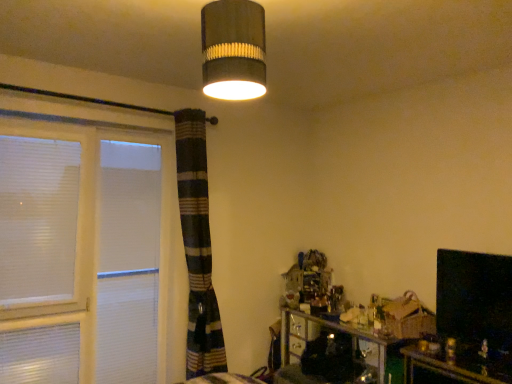
The width and height of the screenshot is (512, 384). What do you see at coordinates (233, 49) in the screenshot?
I see `matte gray cylinder at upper center` at bounding box center [233, 49].

What are the coordinates of `matte gray cylinder at upper center` in the screenshot? It's located at (233, 49).

Where is `matte gray cylinder at upper center`? The image size is (512, 384). matte gray cylinder at upper center is located at coordinates (233, 49).